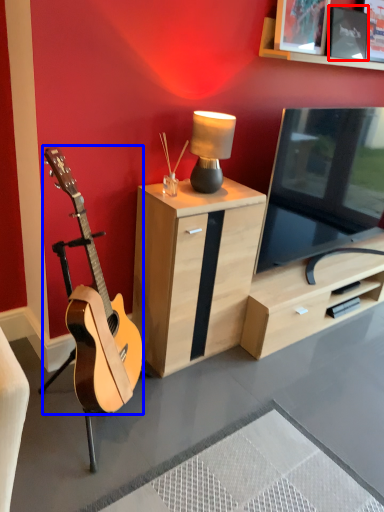
Question: Which point is closer to the camera, picture frame (highlighted by a red box) or guitar (highlighted by a blue box)?

Choices:
 (A) picture frame
 (B) guitar

Answer: (B)